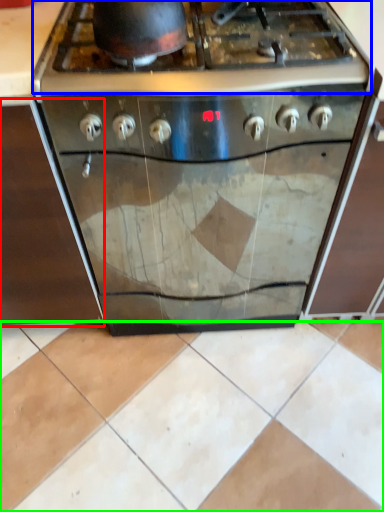
Question: Considering the real-world distances, which object is closest to cabinetry (highlighted by a red box)? gas stove (highlighted by a blue box) or ceramic tile (highlighted by a green box).

Choices:
 (A) gas stove
 (B) ceramic tile

Answer: (A)